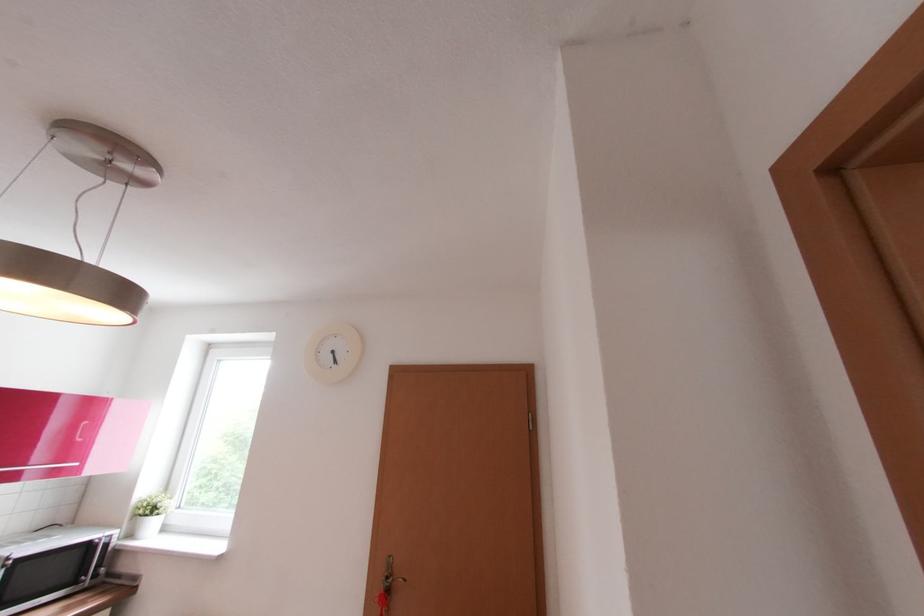
The image size is (924, 616). Describe the element at coordinates (391, 582) in the screenshot. I see `the brown door handle` at that location.